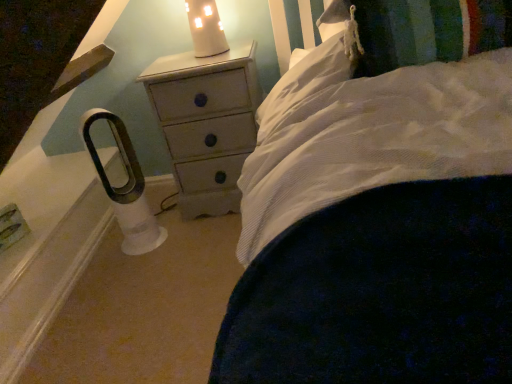
Identify the location of free space in front of white ceramic candle at upper center. (200, 65).